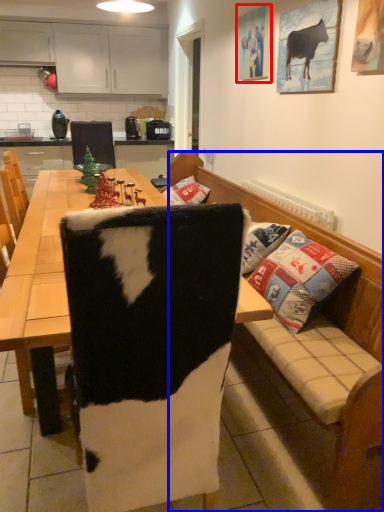
Question: Which object appears farthest to the camera in this image, picture frame (highlighted by a red box) or studio couch (highlighted by a blue box)?

Choices:
 (A) picture frame
 (B) studio couch

Answer: (A)